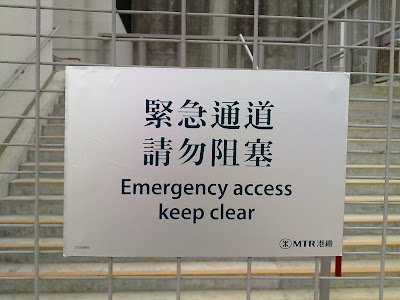
The image size is (400, 300). Find the location of `hand rail`. hand rail is located at coordinates (305, 34).